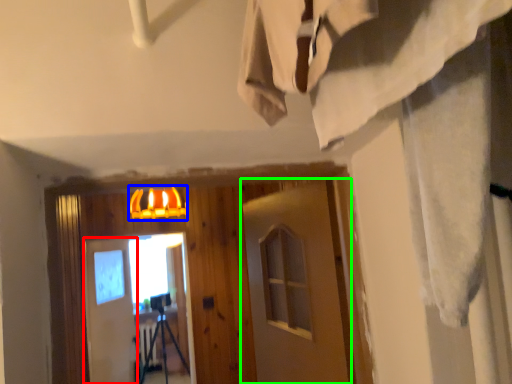
Question: Which object is positioned closest to barn door (highlighted by a red box)? Select from lamp (highlighted by a blue box) and barn door (highlighted by a green box).

Choices:
 (A) lamp
 (B) barn door

Answer: (A)